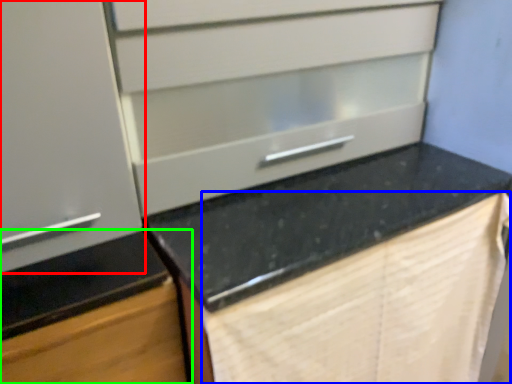
Question: Based on their relative distances, which object is nearer to cabinetry (highlighted by a red box)? Choose from blanket (highlighted by a blue box) and cabinetry (highlighted by a green box).

Choices:
 (A) blanket
 (B) cabinetry

Answer: (B)